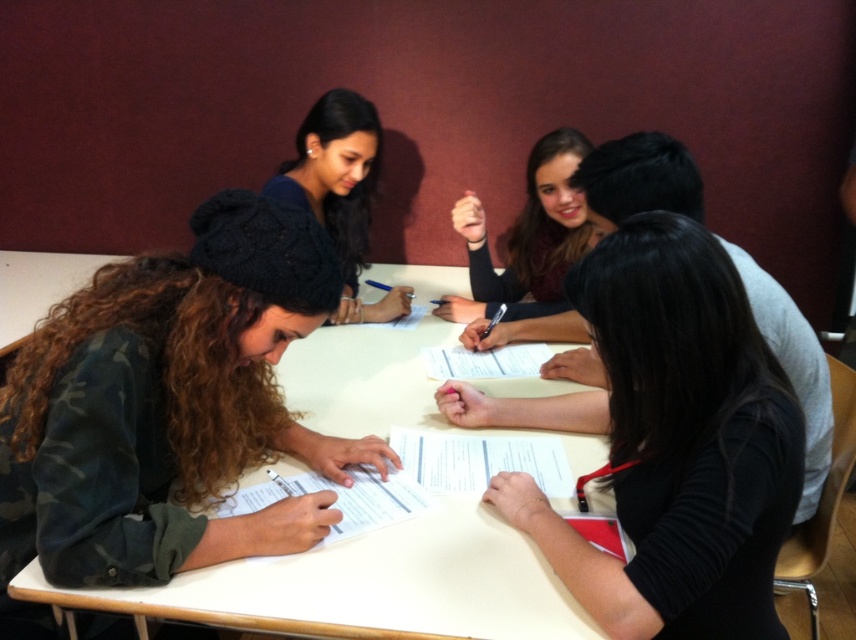
You are standing at the center of the table. Where is the camo fabric beanie at lower left located relative to you?

The camo fabric beanie at lower left is located at the lower left relative to you.

You are standing in the room and see the point at coordinates [676,444]. What is located at that point?

The point at coordinates [676,444] is located on the black matte hair at center.

You are a photographer taking a portrait of the group. You notice the black matte hair at center and the matte black beanie at upper center. Which object is positioned lower in the image?

The black matte hair at center is below the matte black beanie at upper center, so the black matte hair at center is positioned lower in the image.